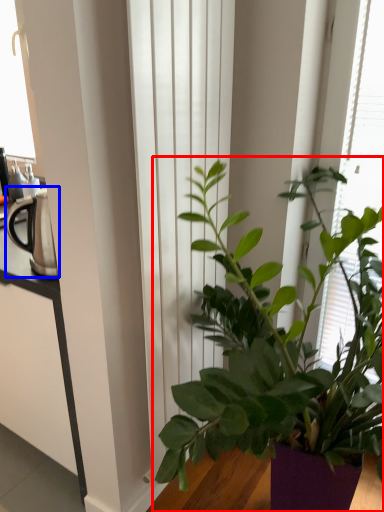
Question: Which point is closer to the camera, houseplant (highlighted by a red box) or appliance (highlighted by a blue box)?

Choices:
 (A) houseplant
 (B) appliance

Answer: (A)